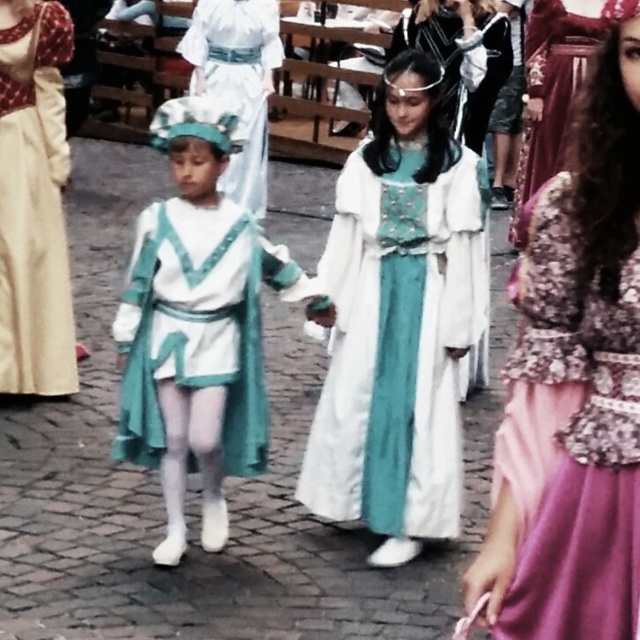
Question: Does white satin dress at center lie behind velvet maroon dress at right?

Choices:
 (A) no
 (B) yes

Answer: (A)

Question: Which point is closer to the camera taking this photo?

Choices:
 (A) (252, 339)
 (B) (8, 68)

Answer: (A)

Question: Is white satin dress at center smaller than teal satin dress at center?

Choices:
 (A) no
 (B) yes

Answer: (B)

Question: Which is nearer to the matte white costume at center?

Choices:
 (A) beige satin dress at left
 (B) white satin dress at center
 (C) pink satin dress at right
 (D) teal satin dress at center

Answer: (B)

Question: Among these points, which one is nearest to the camera?

Choices:
 (A) (577, 58)
 (B) (216, 324)
 (C) (211, 24)
 (D) (556, 525)

Answer: (D)

Question: Observing the image, what is the correct spatial positioning of matte white costume at center in reference to velvet maroon dress at right?

Choices:
 (A) above
 (B) below

Answer: (B)